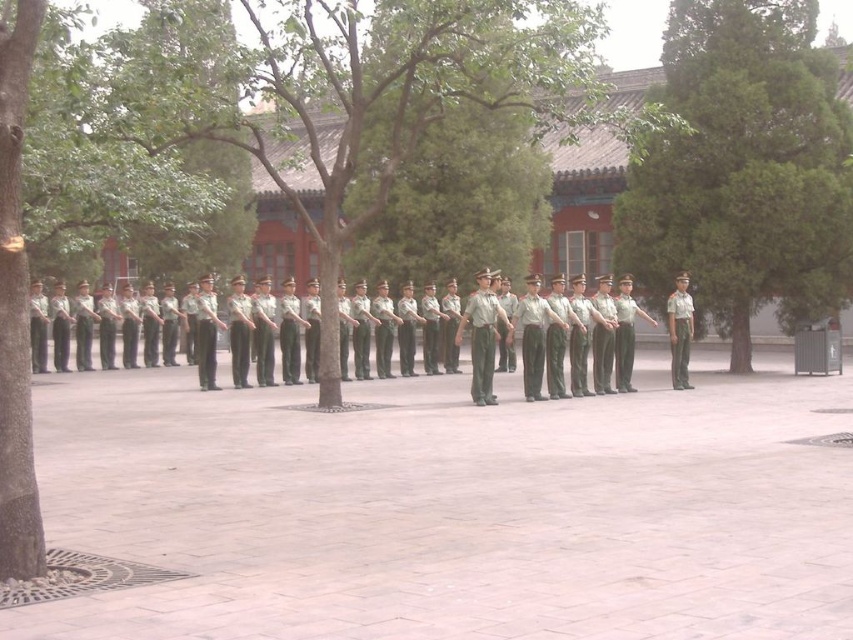
You are a photographer planning to capture a group photo of the uniformed individuals. You want to ensure that both the green textured tree at center and the green leafy tree at left are visible in the background. Which tree will appear taller in the photo?

The green textured tree at center will appear taller in the photo because it has a greater height compared to the green leafy tree at left.

You are a photographer positioned at the origin point of the image. You need to capture a photo of the ceremonial group without including the green textured tree at center in the frame. Based on the coordinates provided, can you determine if the tree will be in the shot?

The green textured tree at center is located at coordinates point [744,168], which is outside the main area where the ceremonial group is standing. Therefore, it can be excluded from the frame by adjusting the camera angle or zoom appropriately.

Looking at this image, you are a photographer trying to capture a photo of the light gray uniform at center while avoiding the green textured tree at center in the background. Based on their positions, which direction should you move to ensure the tree is out of frame?

The green textured tree at center is positioned on the right side of light gray uniform at center. To avoid the tree in the background, you should move to the right of the light gray uniform at center so the tree is no longer in frame.